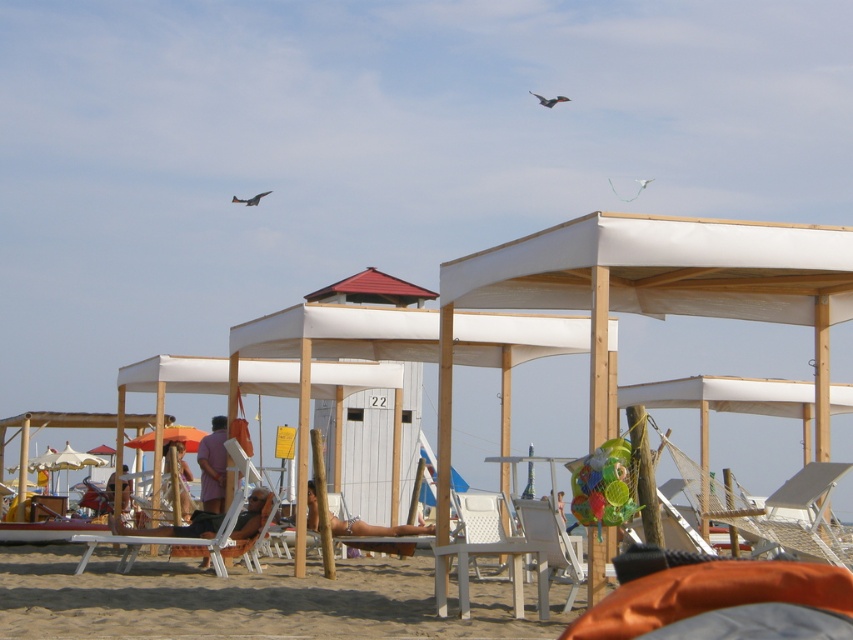
Question: Is white plastic chair at center to the left of white plastic beach chair at center from the viewer's perspective?

Choices:
 (A) yes
 (B) no

Answer: (A)

Question: Which object is positioned farthest from the beige fabric umbrella at center?

Choices:
 (A) white plastic beach chair at center
 (B) tan skin person at center

Answer: (A)

Question: Which point is closer to the camera?

Choices:
 (A) (128, 444)
 (B) (567, 538)
 (C) (833, 525)
 (D) (190, 588)

Answer: (B)

Question: Is white plastic lounge chair at center positioned behind wooden lounge chair at center?

Choices:
 (A) no
 (B) yes

Answer: (A)

Question: Does white plastic chair at center have a larger size compared to tan skin person at center?

Choices:
 (A) yes
 (B) no

Answer: (A)

Question: Which of the following is the closest to the observer?

Choices:
 (A) white plastic lounge chair at center
 (B) pink fabric towel at center
 (C) orange fabric umbrella at center

Answer: (A)